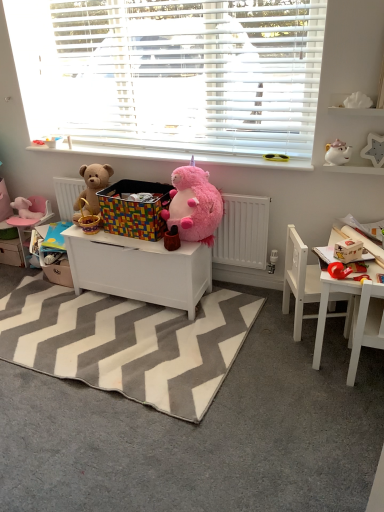
Question: Is matte white storage box at right positioned in front of soft brown teddy bear at left, which is counted as the second teddy bear, starting from the right?

Choices:
 (A) no
 (B) yes

Answer: (B)

Question: Considering the relative sizes of matte white storage box at right and soft brown teddy bear at left, which appears as the first teddy bear when viewed from the left, in the image provided, is matte white storage box at right thinner than soft brown teddy bear at left, which appears as the first teddy bear when viewed from the left,?

Choices:
 (A) yes
 (B) no

Answer: (A)

Question: Is matte white storage box at right behind soft brown teddy bear at left, which appears as the first teddy bear when viewed from the left?

Choices:
 (A) no
 (B) yes

Answer: (A)

Question: Would you say soft brown teddy bear at left, which is counted as the second teddy bear, starting from the right, is part of matte white storage box at right's contents?

Choices:
 (A) no
 (B) yes

Answer: (A)

Question: Are matte white storage box at right and soft brown teddy bear at left, which is counted as the second teddy bear, starting from the right, far apart?

Choices:
 (A) no
 (B) yes

Answer: (B)

Question: Can you confirm if matte white storage box at right is positioned to the right of soft brown teddy bear at left, which appears as the first teddy bear when viewed from the left?

Choices:
 (A) no
 (B) yes

Answer: (B)

Question: Is soft brown teddy bear at left, which appears as the first teddy bear when viewed from the left, at the right side of white matte star at upper right, the 1th toy in the right-to-left sequence?

Choices:
 (A) no
 (B) yes

Answer: (A)

Question: Is soft brown teddy bear at left, which is counted as the second teddy bear, starting from the right, to the left of white matte star at upper right, which is the fifth toy from left to right, from the viewer's perspective?

Choices:
 (A) yes
 (B) no

Answer: (A)

Question: Is there a large distance between soft brown teddy bear at left, which is counted as the second teddy bear, starting from the right, and white matte star at upper right, the 1th toy in the right-to-left sequence?

Choices:
 (A) yes
 (B) no

Answer: (A)

Question: From the image's perspective, is soft brown teddy bear at left, which is counted as the second teddy bear, starting from the right, over white matte star at upper right, which is the fifth toy from left to right?

Choices:
 (A) no
 (B) yes

Answer: (A)

Question: Considering the relative sizes of soft brown teddy bear at left, which appears as the first teddy bear when viewed from the left, and white matte star at upper right, the 1th toy in the right-to-left sequence, in the image provided, is soft brown teddy bear at left, which appears as the first teddy bear when viewed from the left, shorter than white matte star at upper right, the 1th toy in the right-to-left sequence,?

Choices:
 (A) no
 (B) yes

Answer: (A)

Question: From a real-world perspective, is soft brown teddy bear at left, which appears as the first teddy bear when viewed from the left, located higher than white matte star at upper right, which is the fifth toy from back to front?

Choices:
 (A) yes
 (B) no

Answer: (B)

Question: Would you say white plastic sunglasses at upper center contains white matte toy chest at center, placed as the 1th table when sorted from left to right?

Choices:
 (A) no
 (B) yes

Answer: (A)